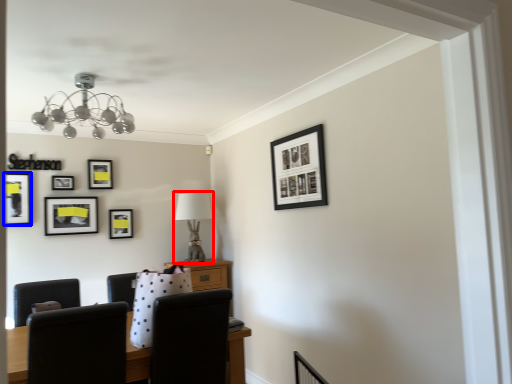
Question: Which point is further to the camera, table lamp (highlighted by a red box) or picture frame (highlighted by a blue box)?

Choices:
 (A) table lamp
 (B) picture frame

Answer: (A)